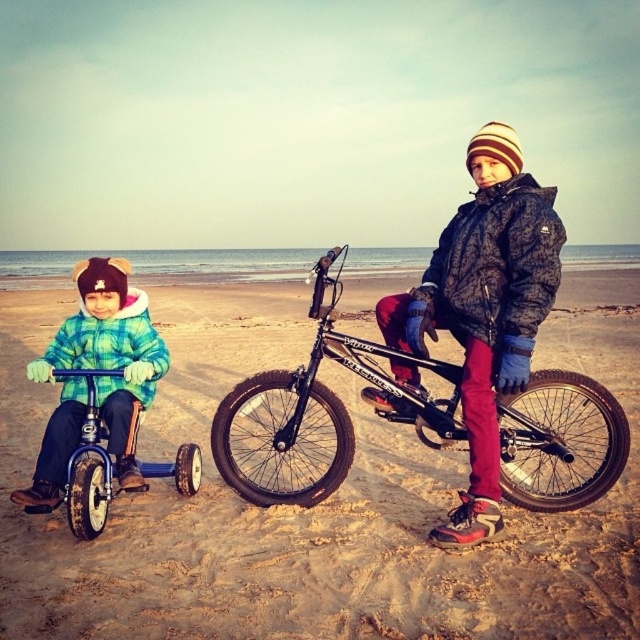
Image resolution: width=640 pixels, height=640 pixels. Identify the location of camouflage jacket at center. (484, 308).

Does camouflage jacket at center appear on the right side of blue plastic tricycle at left?

Correct, you'll find camouflage jacket at center to the right of blue plastic tricycle at left.

This screenshot has width=640, height=640. I want to click on camouflage jacket at center, so click(484, 308).

Image resolution: width=640 pixels, height=640 pixels. In order to click on camouflage jacket at center in this screenshot , I will do `click(484, 308)`.

This screenshot has height=640, width=640. I want to click on matte black bicycle at center, so click(314, 508).

Where is `matte black bicycle at center`? matte black bicycle at center is located at coordinates (314, 508).

Can you confirm if shiny black bicycle at center is taller than camouflage jacket at center?

Yes, shiny black bicycle at center is taller than camouflage jacket at center.

Is shiny black bicycle at center closer to camera compared to camouflage jacket at center?

That is True.

Which is in front, point (552, 490) or point (525, 220)?

Point (525, 220)

Locate an element on the screen. shiny black bicycle at center is located at coordinates (316, 413).